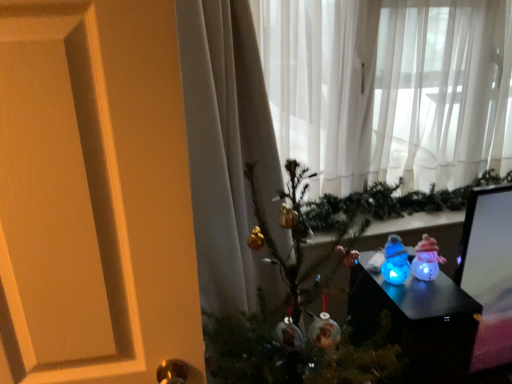
Question: Is blue translucent snowman at center, which is counted as the 2th toy, starting from the right, at the back of metallic gold ornaments at center?

Choices:
 (A) no
 (B) yes

Answer: (A)

Question: Is metallic gold ornaments at center to the right of blue translucent snowman at center, which is counted as the 2th toy, starting from the right, from the viewer's perspective?

Choices:
 (A) no
 (B) yes

Answer: (A)

Question: Does metallic gold ornaments at center lie in front of blue translucent snowman at center, which is counted as the 2th toy, starting from the right?

Choices:
 (A) no
 (B) yes

Answer: (B)

Question: Is metallic gold ornaments at center taller than blue translucent snowman at center, the first toy from the left?

Choices:
 (A) yes
 (B) no

Answer: (A)

Question: Does metallic gold ornaments at center have a smaller size compared to blue translucent snowman at center, which is counted as the 2th toy, starting from the right?

Choices:
 (A) yes
 (B) no

Answer: (B)

Question: From their relative heights in the image, would you say metallic gold ornaments at center is taller or shorter than blue translucent snowman at center, which is counted as the 2th toy, starting from the right?

Choices:
 (A) tall
 (B) short

Answer: (A)

Question: Looking at their shapes, would you say metallic gold ornaments at center is wider or thinner than blue translucent snowman at center, which is counted as the 2th toy, starting from the right?

Choices:
 (A) thin
 (B) wide

Answer: (B)

Question: From a real-world perspective, is metallic gold ornaments at center physically located above or below blue translucent snowman at center, the first toy from the left?

Choices:
 (A) above
 (B) below

Answer: (B)

Question: Visually, is metallic gold ornaments at center positioned to the left or to the right of blue translucent snowman at center, which is counted as the 2th toy, starting from the right?

Choices:
 (A) right
 (B) left

Answer: (B)

Question: Looking at their shapes, would you say blue translucent snowman at center, the first toy from the left, is wider or thinner than translucent plastic snowman at center-right, the 2th toy viewed from the left?

Choices:
 (A) thin
 (B) wide

Answer: (B)

Question: From the image's perspective, is blue translucent snowman at center, which is counted as the 2th toy, starting from the right, above or below translucent plastic snowman at center-right, marked as the 1th toy in a right-to-left arrangement?

Choices:
 (A) above
 (B) below

Answer: (A)

Question: Which is correct: blue translucent snowman at center, the first toy from the left, is inside translucent plastic snowman at center-right, marked as the 1th toy in a right-to-left arrangement, or outside of it?

Choices:
 (A) inside
 (B) outside

Answer: (B)

Question: Considering the relative positions of blue translucent snowman at center, which is counted as the 2th toy, starting from the right, and translucent plastic snowman at center-right, the 2th toy viewed from the left, in the image provided, is blue translucent snowman at center, which is counted as the 2th toy, starting from the right, to the left or to the right of translucent plastic snowman at center-right, the 2th toy viewed from the left,?

Choices:
 (A) left
 (B) right

Answer: (A)

Question: Relative to translucent plastic snowmen at lower right, is sheer white curtain at upper center in front or behind?

Choices:
 (A) behind
 (B) front

Answer: (A)

Question: In terms of height, does sheer white curtain at upper center look taller or shorter compared to translucent plastic snowmen at lower right?

Choices:
 (A) tall
 (B) short

Answer: (A)